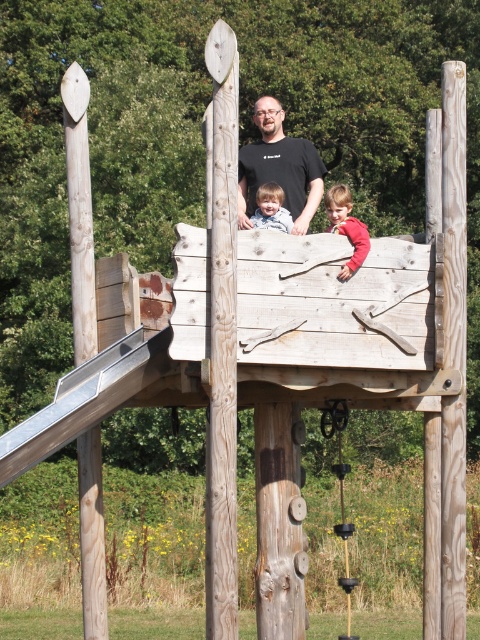
Can you confirm if natural wood pole at center is bigger than black plastic swing at center?

Incorrect, natural wood pole at center is not larger than black plastic swing at center.

Which is in front, point (220, 291) or point (342, 584)?

Positioned in front is point (220, 291).

Image resolution: width=480 pixels, height=640 pixels. I want to click on natural wood pole at center, so click(222, 342).

Based on the photo, who is positioned more to the left, matte red shirt at upper center or smooth beige shirt at center?

Positioned to the left is smooth beige shirt at center.

The image size is (480, 640). I want to click on matte red shirt at upper center, so point(346,227).

Which is below, natural wood pole at left or matte red shirt at upper center?

natural wood pole at left is lower down.

At what (x,y) coordinates should I click in order to perform the action: click on natural wood pole at left. Please return your answer as a coordinate pair (x, y). Looking at the image, I should click on (80, 212).